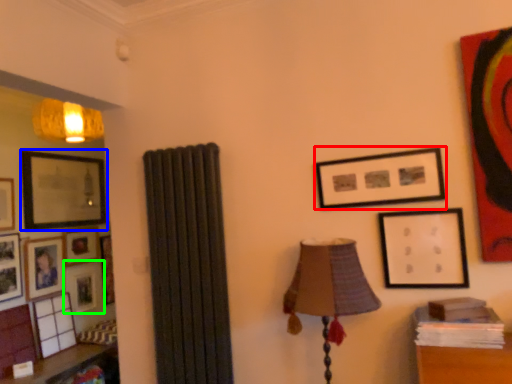
Question: Considering the real-world distances, which object is farthest from picture frame (highlighted by a red box)? picture frame (highlighted by a blue box) or picture frame (highlighted by a green box)?

Choices:
 (A) picture frame
 (B) picture frame

Answer: (B)